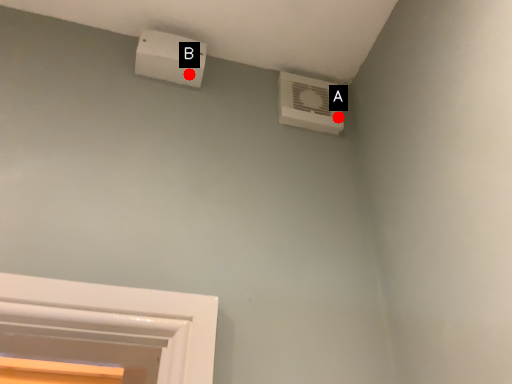
Question: Two points are circled on the image, labeled by A and B beside each circle. Which point is closer to the camera taking this photo?

Choices:
 (A) A is closer
 (B) B is closer

Answer: (B)